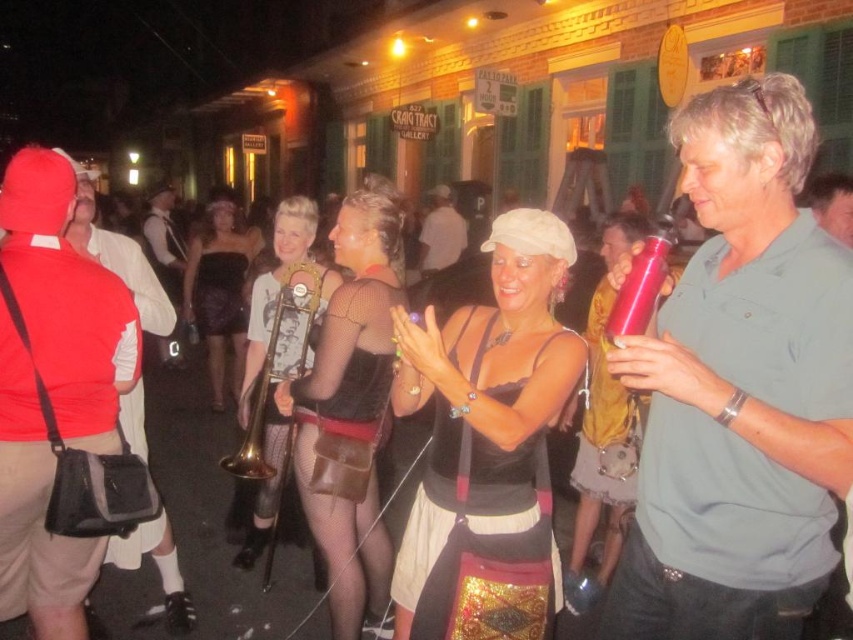
You are a participant in the event and need to locate your matte red water bottle at center. According to the coordinates given, where exactly would you find it?

The matte red water bottle at center is located at point coordinates (740, 388).

You are a photographer at the event and want to capture the woman in the center holding the microphone. You notice the matte red water bottle at center and the matte black tank top at center. Which object is to the right of the other?

The matte red water bottle at center is positioned on the right side of matte black tank top at center.

You are a photographer trying to capture a candid shot of the matte black dress at center and the gold metallic trombone at center in the same frame. Given that your camera has a minimum focus distance of 18 inches, will you be able to focus on both subjects clearly?

The matte black dress at center and gold metallic trombone at center are 18.15 inches apart. Since the distance between them is slightly more than the camera minimum focus distance of 18 inches, the photographer can focus on both subjects clearly.